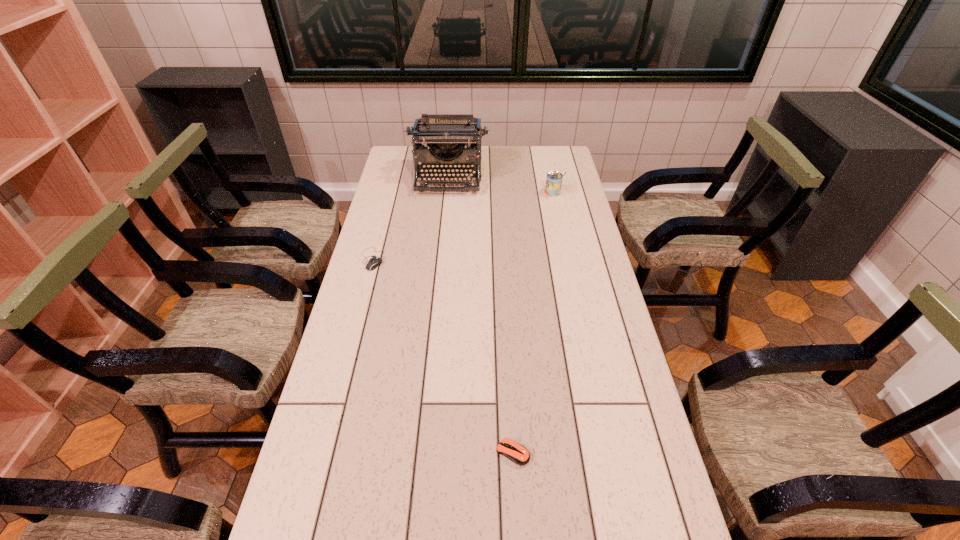
At what (x,y) coordinates should I click in order to perform the action: click on typewriter. Please return your answer as a coordinate pair (x, y). The width and height of the screenshot is (960, 540). Looking at the image, I should click on (446, 135).

Locate an element on the screen. The image size is (960, 540). the second tallest object is located at coordinates (554, 178).

Where is `can`? This screenshot has width=960, height=540. can is located at coordinates (554, 178).

Locate an element on the screen. the third farthest object is located at coordinates (372, 264).

Where is `the left computer mouse`? This screenshot has height=540, width=960. the left computer mouse is located at coordinates (372, 264).

Where is `the right computer mouse`? This screenshot has height=540, width=960. the right computer mouse is located at coordinates (517, 453).

Locate an element on the screen. the nearer computer mouse is located at coordinates (517, 453).

This screenshot has height=540, width=960. In order to click on vacant space located 0.280m on the typing side of the typewriter in this screenshot , I will do `click(443, 240)`.

Where is `vacant region located 0.260m on the front of the rightmost object`? vacant region located 0.260m on the front of the rightmost object is located at coordinates (564, 239).

Identify the location of vacant space situated on the front of the left computer mouse. (356, 319).